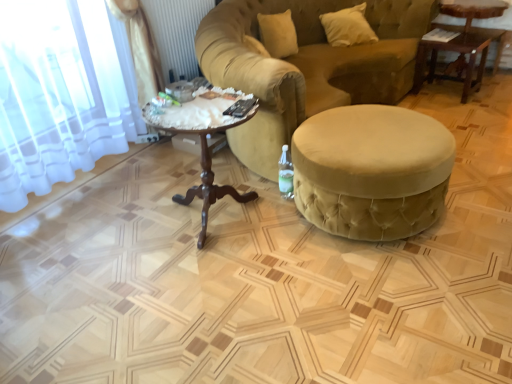
Find the location of a particular element. The image size is (512, 384). free region on the left part of mahogany wood coffee table at center is located at coordinates (121, 225).